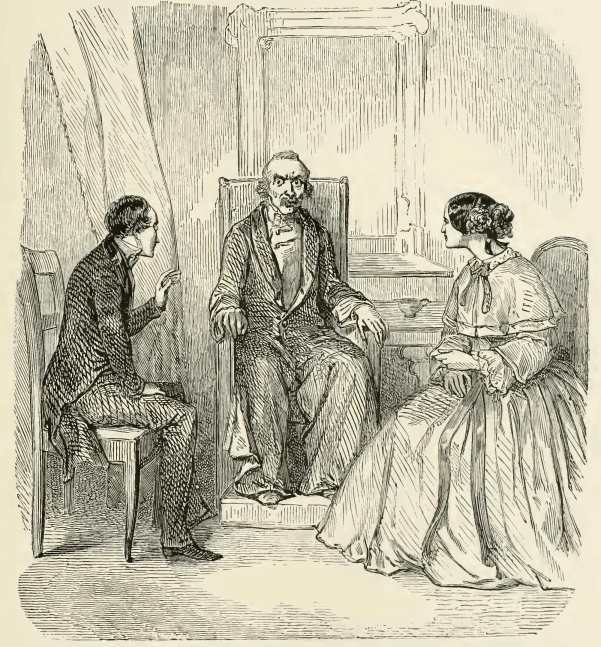
Locate an element on the screen. mirror is located at coordinates (328, 129).